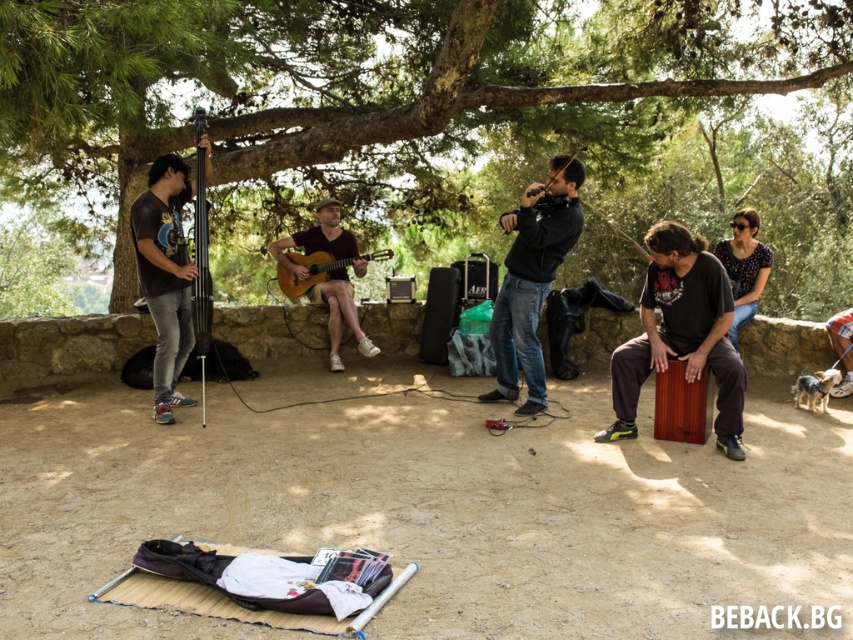
You are a photographer setting up for an outdoor music session. You have a camera with a 1.8 meter height limit for equipment. You need to place both the black matte bass guitar at left and the wooden acoustic guitar at center in your shot without exceeding the height limit. Can you fit both instruments within this constraint?

The black matte bass guitar at left is taller than the wooden acoustic guitar at center. Since the tallest instrument is the black matte bass guitar at left, and it is within the 1.8 meter height limit, both can be accommodated in the shot.

You are a photographer at the event and want to capture a group photo of the floral shirt at upper right and the matte black camera at center. Since you want to ensure both subjects are clearly visible, which one should you focus on first considering their sizes?

The floral shirt at upper right is larger in width than the matte black camera at center, so you should focus on the floral shirt at upper right first to ensure its details are sharp before adjusting for the smaller matte black camera at center.